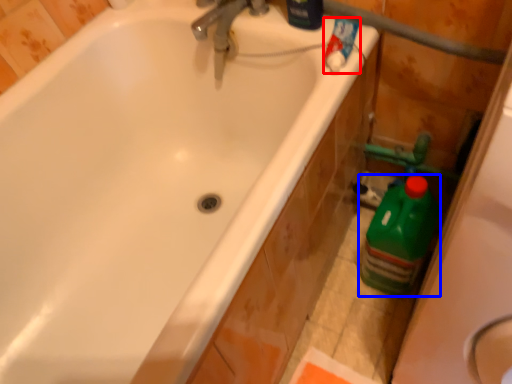
Question: Which of the following is the farthest to the observer, cleaning product (highlighted by a red box) or cleaning product (highlighted by a blue box)?

Choices:
 (A) cleaning product
 (B) cleaning product

Answer: (B)